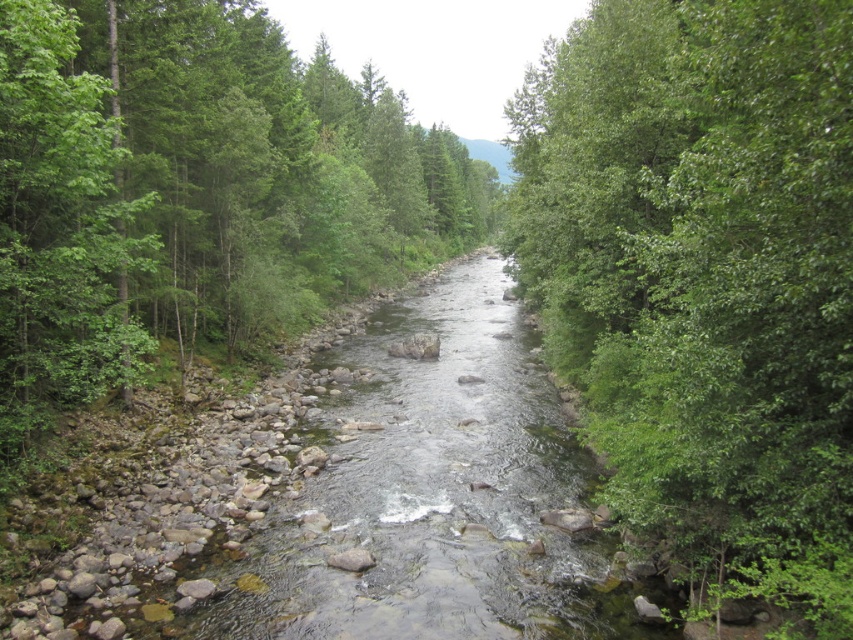
Question: Which of the following is the closest to the observer?

Choices:
 (A) (819, 404)
 (B) (27, 88)

Answer: (A)

Question: Does green leafy tree at right have a smaller size compared to green leafy tree at center?

Choices:
 (A) yes
 (B) no

Answer: (A)

Question: Can you confirm if green leafy tree at right is positioned to the left of green leafy tree at center?

Choices:
 (A) yes
 (B) no

Answer: (B)

Question: Is green leafy tree at right closer to the viewer compared to green leafy tree at center?

Choices:
 (A) no
 (B) yes

Answer: (B)